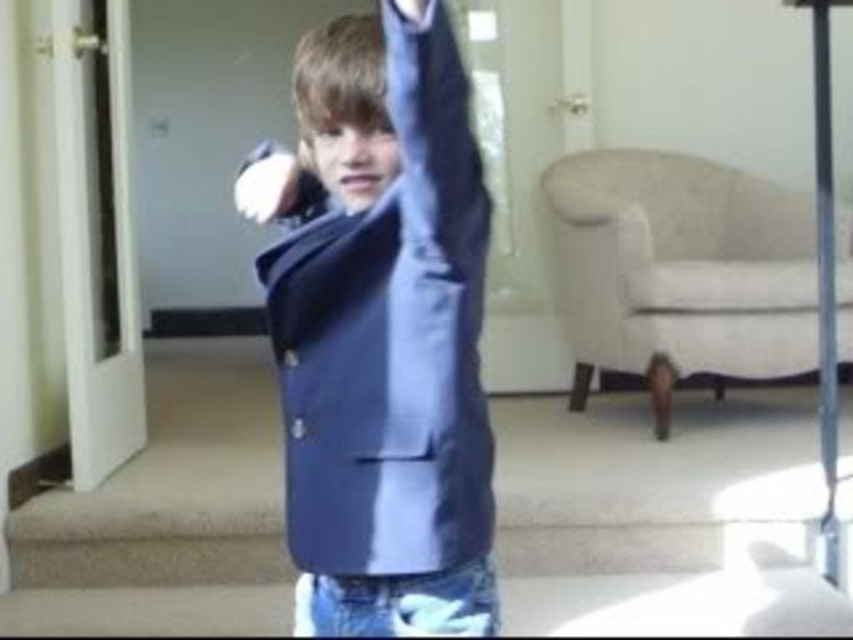
You are designing a new clothing catalog layout and need to place the satin blue blazer at center and the satin blue blazer at upper center next to each other. Based on their sizes, which one should you place on the left side to ensure they fit properly?

The satin blue blazer at center is wider than the satin blue blazer at upper center, so you should place the wider one on the left to accommodate its size.

You are a fashion designer observing the scene and want to adjust the placement of the satin blue blazer at center and the satin blue blazer at upper center for a photoshoot. Which blazer is closer to the camera?

The satin blue blazer at center is closer to the camera than the satin blue blazer at upper center.